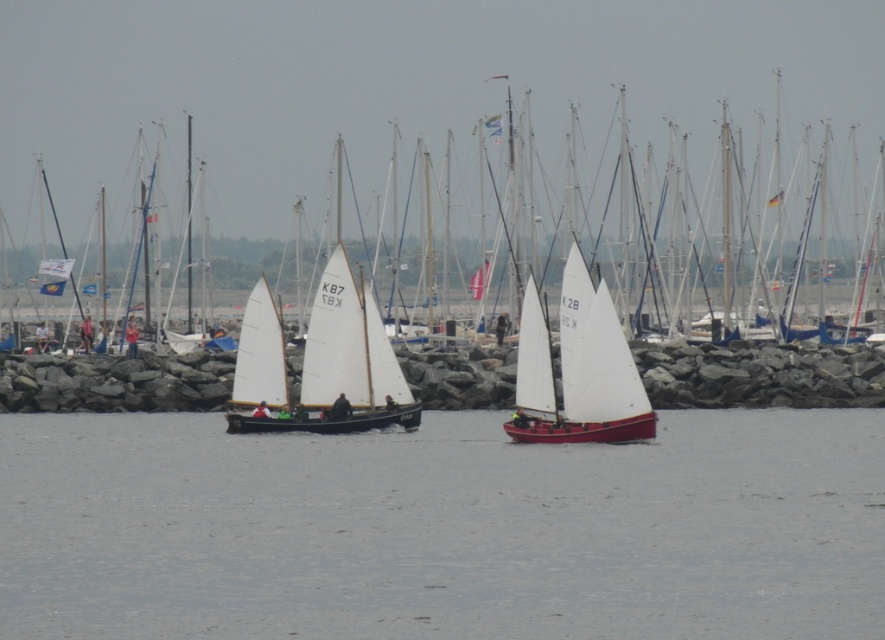
Does clear water at center appear over white canvas sailboat at center?

No.

Who is more distant from viewer, (x=612, y=520) or (x=559, y=324)?

Point (x=559, y=324)

Where is `clear water at center`? This screenshot has height=640, width=885. clear water at center is located at coordinates (442, 529).

What are the coordinates of `clear water at center` in the screenshot? It's located at (442, 529).